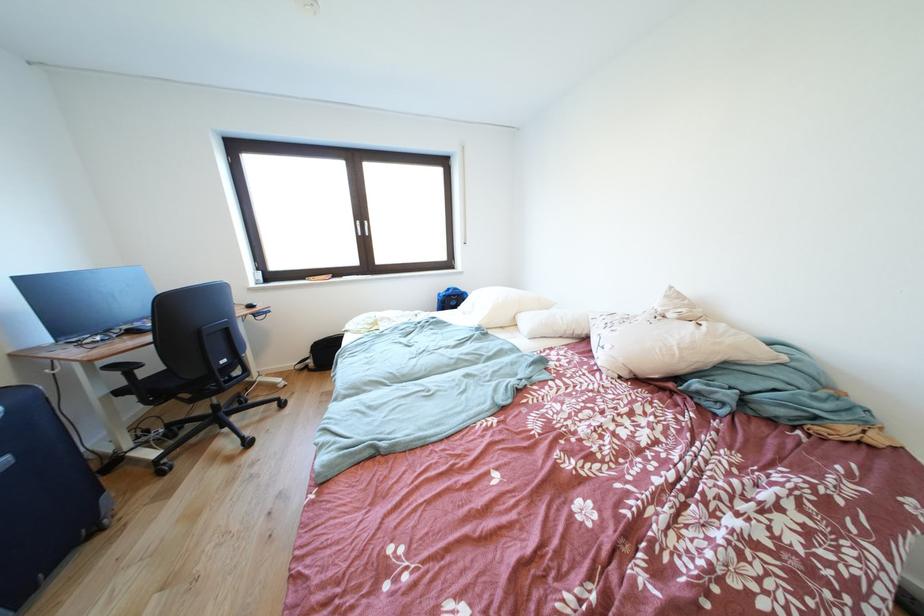
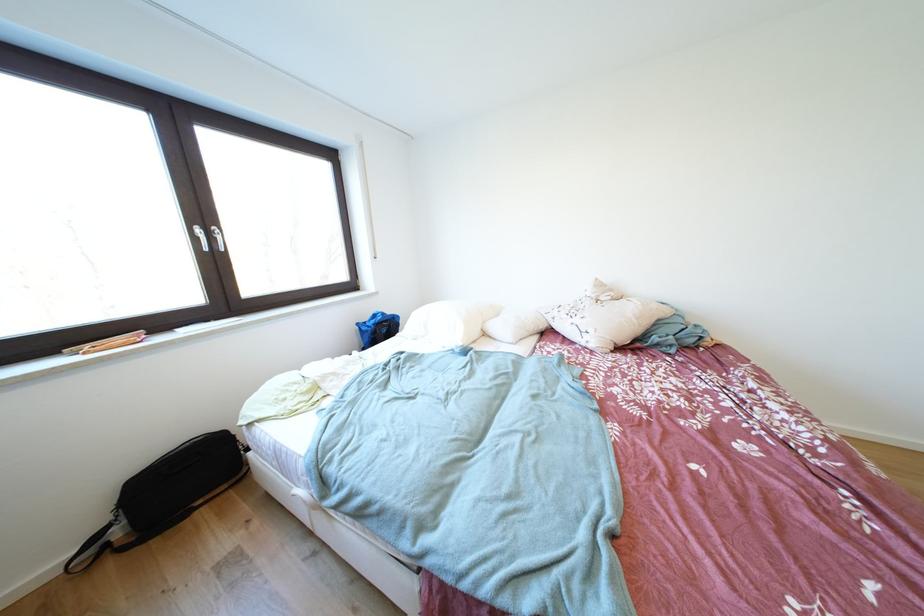
In the second image, find the point that corresponds to the point at 447,299 in the first image.

(367, 329)